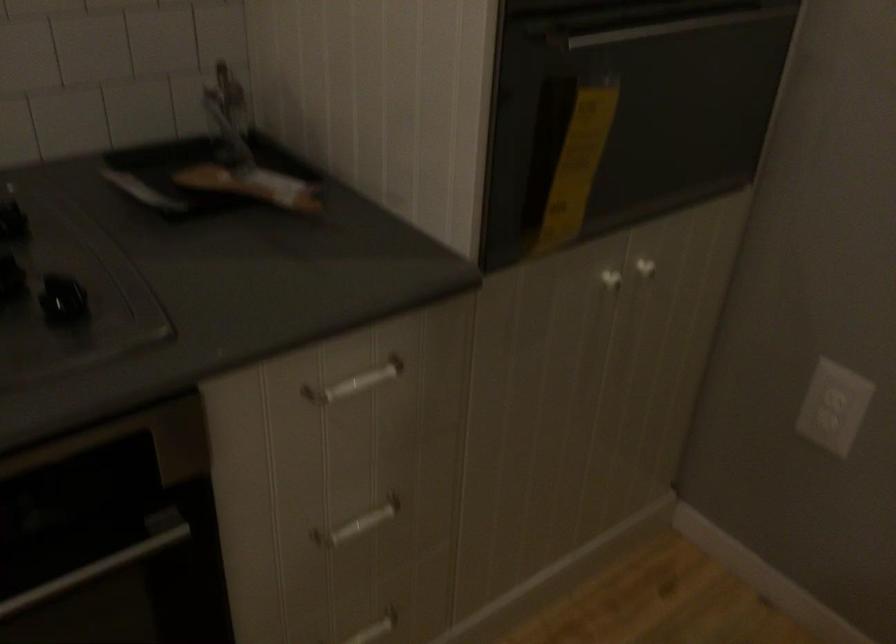
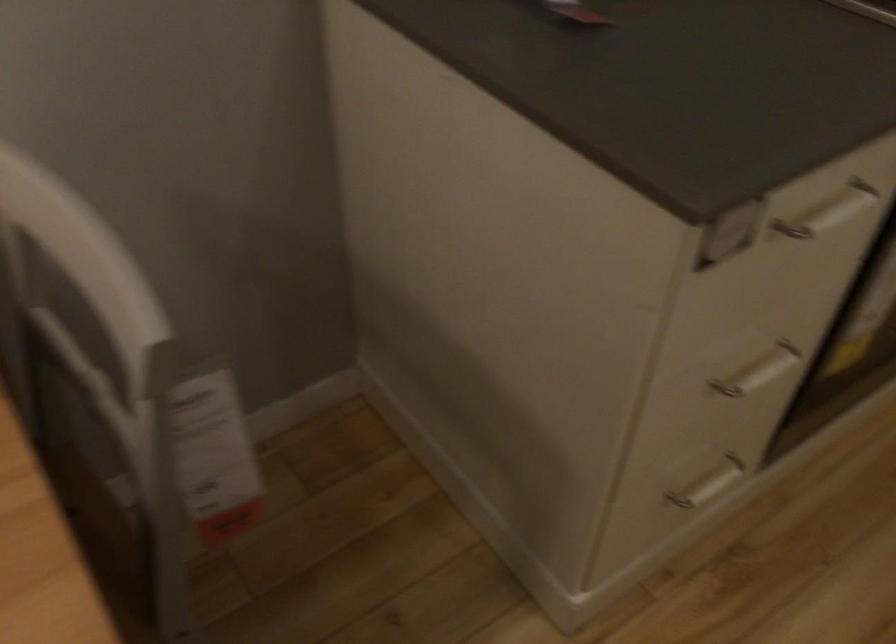
Question: The images are taken continuously from a first-person perspective. In which direction are you moving?

Choices:
 (A) Left
 (B) Right
 (C) Forward
 (D) Backward

Answer: (A)